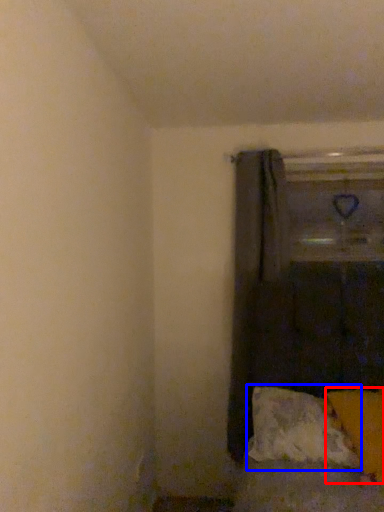
Question: Which object appears closest to the camera in this image, pillow (highlighted by a red box) or pillow (highlighted by a blue box)?

Choices:
 (A) pillow
 (B) pillow

Answer: (A)